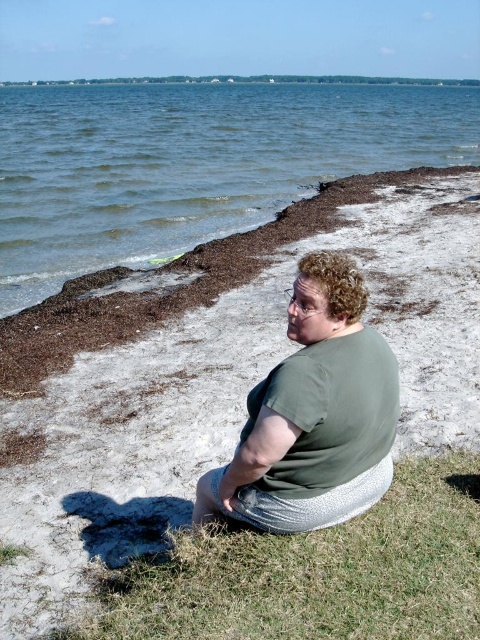
You are a photographer planning to take a portrait of the person in the scene. Considering the green grass at lower center and the green fabric shirt at center, which one is shorter in height?

The green grass at lower center is shorter in height compared to the green fabric shirt at center.

You are a drone operator who needs to capture a photo of the blue water at upper center and the green fabric shirt at center in the same frame. The drone can only capture a maximum distance of 130 feet between the closest and farthest objects. Will you be able to include both in the photo?

The distance between the blue water at upper center and the green fabric shirt at center is 132.54 feet, which exceeds the drone camera range of 130 feet. Therefore, both cannot be captured in the same frame.

You are standing at the edge of the brown sandy beach at lower left and want to walk towards the green fabric shirt at center. Which direction should you move in to get closer to the shirt?

You should move towards the center of the image because the green fabric shirt at center is closer to you than the brown sandy beach at lower left, which is further away.